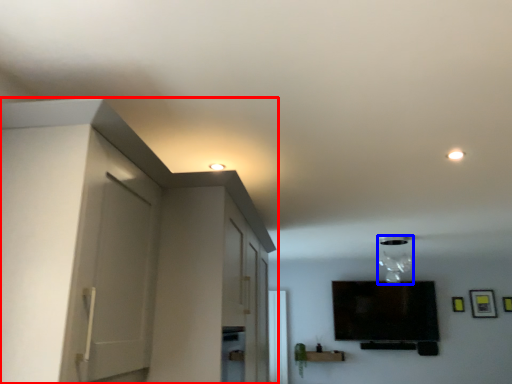
Question: Which object appears farthest to the camera in this image, dresser (highlighted by a red box) or light fixture (highlighted by a blue box)?

Choices:
 (A) dresser
 (B) light fixture

Answer: (B)